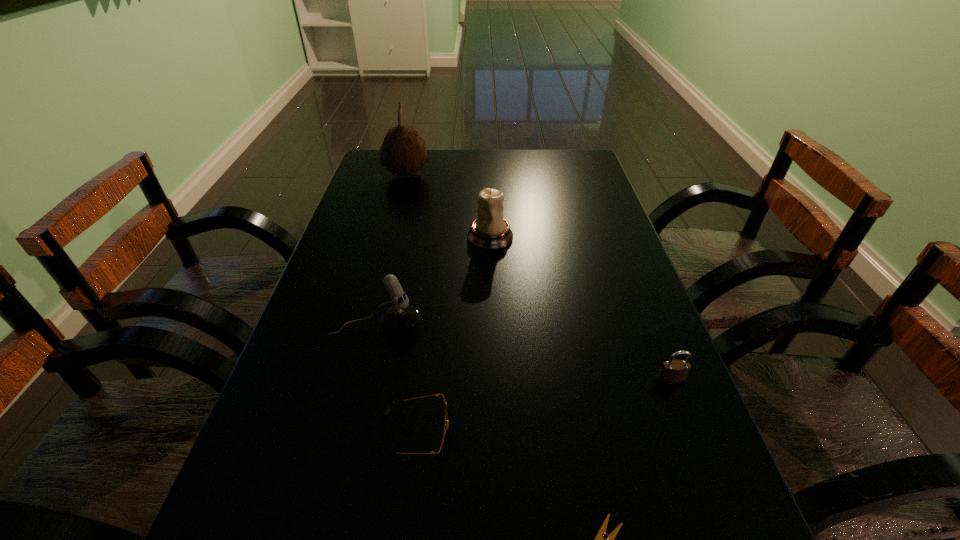
Where is `the farthest object`? The image size is (960, 540). the farthest object is located at coordinates coord(403,152).

Where is `the tallest object`? This screenshot has width=960, height=540. the tallest object is located at coordinates (403, 152).

The image size is (960, 540). What are the coordinates of `candle holder` in the screenshot? It's located at (490, 231).

You are a GUI agent. You are given a task and a screenshot of the screen. Output one action in this format:
    pyautogui.click(x=<x>, y=<y>)
    Task: Click on the third object from right to left
    
    Given the screenshot: What is the action you would take?
    pyautogui.click(x=490, y=231)

This screenshot has width=960, height=540. I want to click on the third farthest object, so click(x=401, y=318).

Find the location of a particular element. This screenshot has width=960, height=540. the third nearest object is located at coordinates (673, 372).

The width and height of the screenshot is (960, 540). In order to click on the fourth tallest object in this screenshot , I will do `click(673, 372)`.

Locate an element on the screen. The height and width of the screenshot is (540, 960). the second nearest object is located at coordinates (445, 432).

Locate an element on the screen. Image resolution: width=960 pixels, height=540 pixels. sunglasses is located at coordinates (445, 432).

Where is `vacant space located on the surface of the coconut`? The height and width of the screenshot is (540, 960). vacant space located on the surface of the coconut is located at coordinates point(540,175).